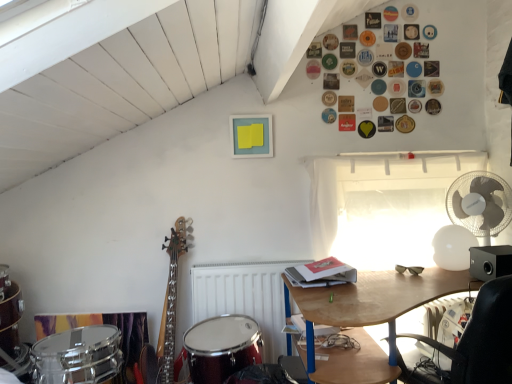
Question: Considering their positions, is wooden desk at lower right located in front of or behind matte black sunglasses at center right?

Choices:
 (A) front
 (B) behind

Answer: (A)

Question: Would you say wooden desk at lower right is to the left or to the right of matte black sunglasses at center right in the picture?

Choices:
 (A) left
 (B) right

Answer: (A)

Question: Which object is the farthest from the white sheer curtain at upper right?

Choices:
 (A) white matte radiator at lower center
 (B) shiny red drum at lower left
 (C) black plastic speaker at right
 (D) matte black sunglasses at center right
 (E) black leather chair at lower right

Answer: (B)

Question: Estimate the real-world distances between objects in this image. Which object is closer to the shiny red drum at lower left?

Choices:
 (A) white plastic fan at right
 (B) wooden desk at lower right
 (C) black plastic speaker at right
 (D) white sheer curtain at upper right
 (E) black leather chair at lower right

Answer: (B)